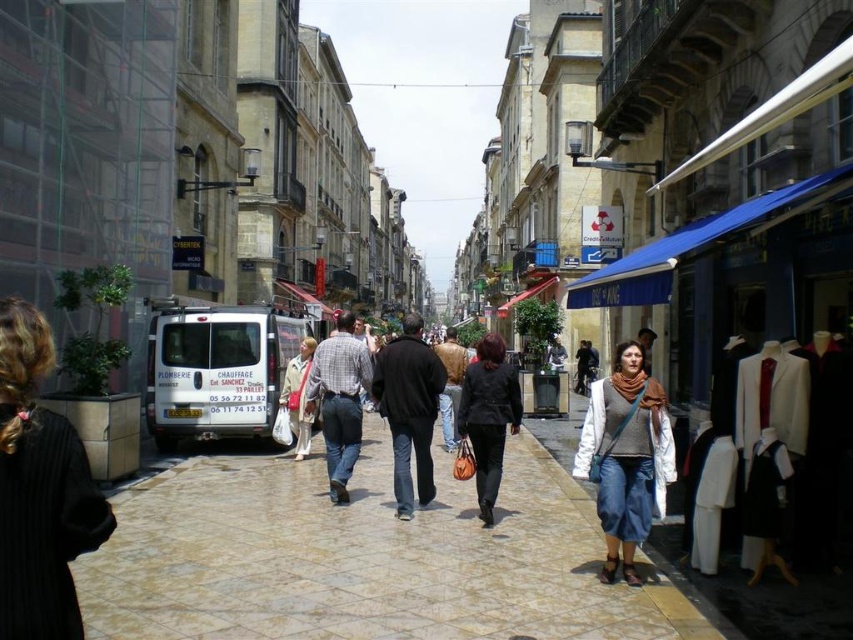
Is point (631, 364) less distant than point (428, 483)?

Yes.

Can you confirm if knit gray sweater at center is positioned below black leather jacket at center?

Indeed, knit gray sweater at center is positioned under black leather jacket at center.

The width and height of the screenshot is (853, 640). Describe the element at coordinates (625, 456) in the screenshot. I see `knit gray sweater at center` at that location.

At what (x,y) coordinates should I click in order to perform the action: click on knit gray sweater at center. Please return your answer as a coordinate pair (x, y). This screenshot has height=640, width=853. Looking at the image, I should click on (625, 456).

Looking at this image, between black wool coat at lower left and plaid cotton shirt at center, which one appears on the right side from the viewer's perspective?

plaid cotton shirt at center

Image resolution: width=853 pixels, height=640 pixels. What do you see at coordinates (39, 490) in the screenshot?
I see `black wool coat at lower left` at bounding box center [39, 490].

This screenshot has height=640, width=853. In order to click on black wool coat at lower left in this screenshot , I will do `click(39, 490)`.

Is black wool coat at lower left to the left of knit gray sweater at center from the viewer's perspective?

Indeed, black wool coat at lower left is positioned on the left side of knit gray sweater at center.

Is black wool coat at lower left above knit gray sweater at center?

Indeed, black wool coat at lower left is positioned over knit gray sweater at center.

Is point (54, 436) positioned before point (596, 509)?

That is True.

Find the location of `black wool coat at lower left`. black wool coat at lower left is located at coordinates (39, 490).